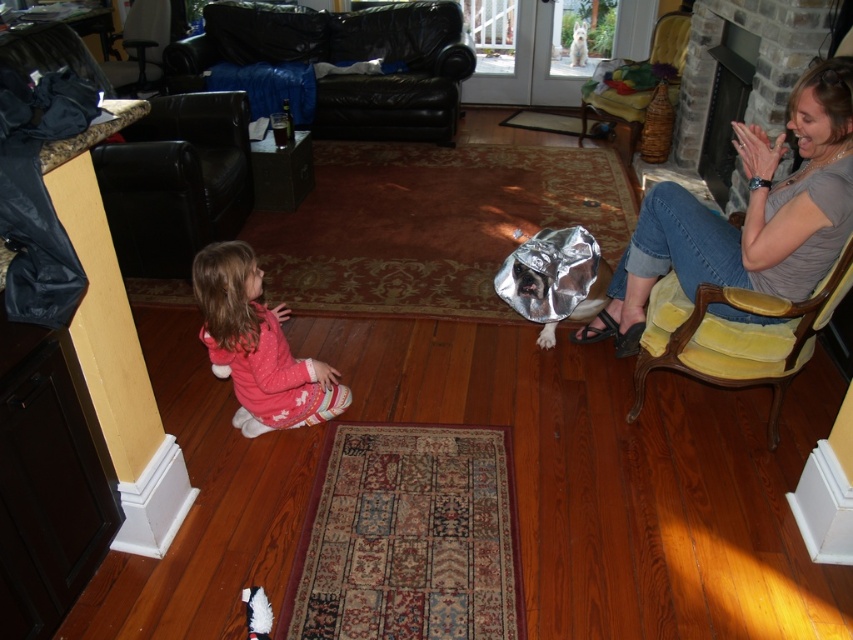
How much distance is there between yellow velvet armchair at right and pink fleece pants at lower left?

They are 1.36 meters apart.

Does yellow velvet armchair at right appear under pink fleece pants at lower left?

Indeed, yellow velvet armchair at right is positioned under pink fleece pants at lower left.

Is point (769, 374) farther from viewer compared to point (294, 371)?

Yes, point (769, 374) is farther from viewer.

This screenshot has height=640, width=853. In order to click on yellow velvet armchair at right in this screenshot , I will do `click(735, 336)`.

Image resolution: width=853 pixels, height=640 pixels. Identify the location of yellow velvet armchair at right. (735, 336).

Looking at this image, how much distance is there between yellow velvet armchair at right and velvet yellow armchair at upper right?

yellow velvet armchair at right and velvet yellow armchair at upper right are 9.08 feet apart.

Which is behind, point (701, 330) or point (671, 90)?

The point (671, 90) is more distant.

At what (x,y) coordinates should I click in order to perform the action: click on yellow velvet armchair at right. Please return your answer as a coordinate pair (x, y). Looking at the image, I should click on (735, 336).

Which is behind, point (817, 157) or point (631, 129)?

The point (631, 129) is more distant.

Which is behind, point (694, 275) or point (660, 42)?

Point (660, 42)

Locate an element on the screen. The width and height of the screenshot is (853, 640). denim jeans at right is located at coordinates (747, 216).